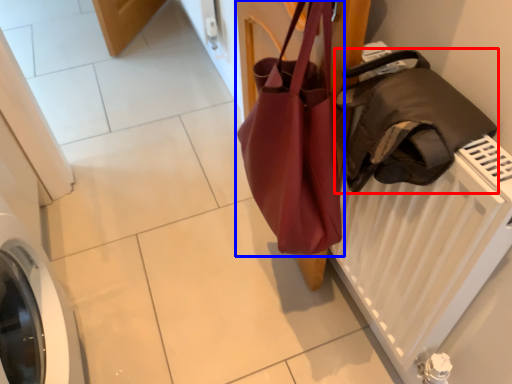
Question: Which point is further to the camera, luggage and bags (highlighted by a red box) or handbag (highlighted by a blue box)?

Choices:
 (A) luggage and bags
 (B) handbag

Answer: (B)